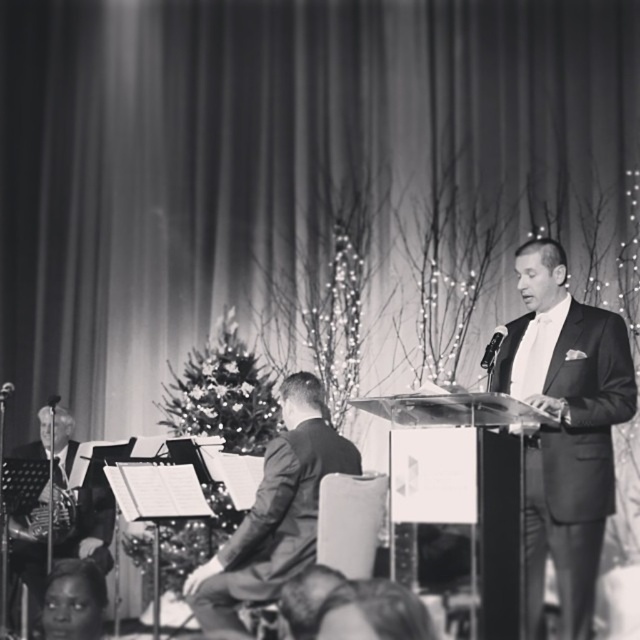
Who is shorter, shiny silver saxophone at left or metallic at podium?

Standing shorter between the two is metallic at podium.

Can you confirm if shiny silver saxophone at left is positioned below metallic at podium?

Correct, shiny silver saxophone at left is located below metallic at podium.

The image size is (640, 640). I want to click on shiny silver saxophone at left, so click(x=90, y=528).

Image resolution: width=640 pixels, height=640 pixels. I want to click on shiny silver saxophone at left, so click(x=90, y=528).

Between point (561, 432) and point (497, 340), which one is positioned behind?

Positioned behind is point (497, 340).

Locate an element on the screen. smooth black suit at right is located at coordinates (564, 428).

Where is `smooth black suit at right`? This screenshot has height=640, width=640. smooth black suit at right is located at coordinates (564, 428).

Who is positioned more to the left, shiny silver saxophone at left or smooth skin face at lower left?

Positioned to the left is shiny silver saxophone at left.

Which is more to the right, shiny silver saxophone at left or smooth skin face at lower left?

smooth skin face at lower left

In order to click on shiny silver saxophone at left in this screenshot , I will do `click(90, 528)`.

You are a GUI agent. You are given a task and a screenshot of the screen. Output one action in this format:
    pyautogui.click(x=<x>, y=<y>)
    Task: Click on the shiny silver saxophone at left
    The width and height of the screenshot is (640, 640).
    Given the screenshot: What is the action you would take?
    pyautogui.click(x=90, y=528)